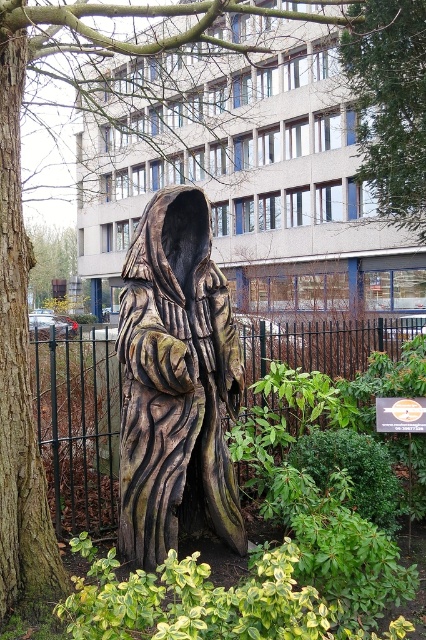
Does wooden statue at center come in front of brown textured bark at left?

No, it is not.

The image size is (426, 640). Find the location of `wooden statue at center`. wooden statue at center is located at coordinates (175, 381).

Is point (219, 467) closer to viewer compared to point (339, 60)?

Yes.

Does wooden statue at center come in front of green leafy tree at upper center?

That is True.

Is point (138, 458) less distant than point (379, 204)?

Yes, it is in front of point (379, 204).

Identify the location of wooden statue at center. Image resolution: width=426 pixels, height=640 pixels. (175, 381).

Between brown textured bark at left and green leafy tree at upper center, which one is positioned lower?

brown textured bark at left

Does brown textured bark at left come behind green leafy tree at upper center?

No, brown textured bark at left is in front of green leafy tree at upper center.

Between point (29, 557) and point (400, 33), which one is positioned behind?

Positioned behind is point (400, 33).

Where is `brown textured bark at left`? The image size is (426, 640). brown textured bark at left is located at coordinates (19, 374).